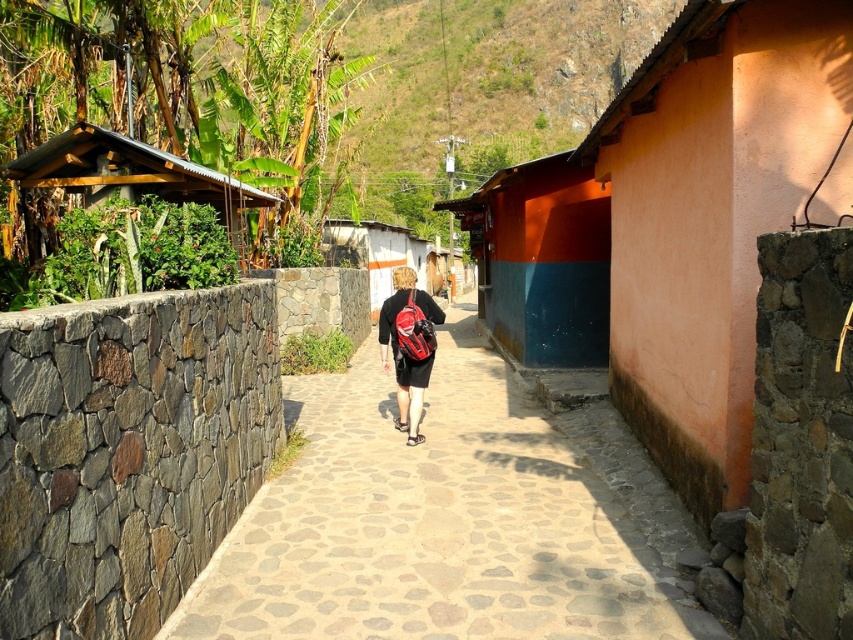
Question: Which object is closer to the camera taking this photo?

Choices:
 (A) matte red backpack at center
 (B) white stucco hut at center
 (C) wooden hut at left
 (D) stone paved path at center

Answer: (D)

Question: Does orange smooth wall at right have a greater width compared to orange painted wall at center?

Choices:
 (A) yes
 (B) no

Answer: (B)

Question: From the image, what is the correct spatial relationship of stone paved path at center in relation to white stucco hut at center?

Choices:
 (A) above
 (B) below

Answer: (B)

Question: Which point is closer to the camera?

Choices:
 (A) (560, 280)
 (B) (387, 342)
 (C) (405, 246)
 (D) (656, 296)

Answer: (D)

Question: Can you confirm if stone paved path at center is smaller than wooden hut at left?

Choices:
 (A) no
 (B) yes

Answer: (A)

Question: Which object is the farthest from the wooden hut at left?

Choices:
 (A) stone paved path at center
 (B) white stucco hut at center

Answer: (B)